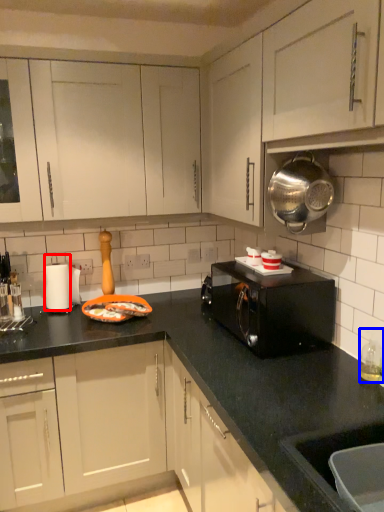
Question: Which of the following is the closest to the observer, appliance (highlighted by a red box) or bottle (highlighted by a blue box)?

Choices:
 (A) appliance
 (B) bottle

Answer: (B)